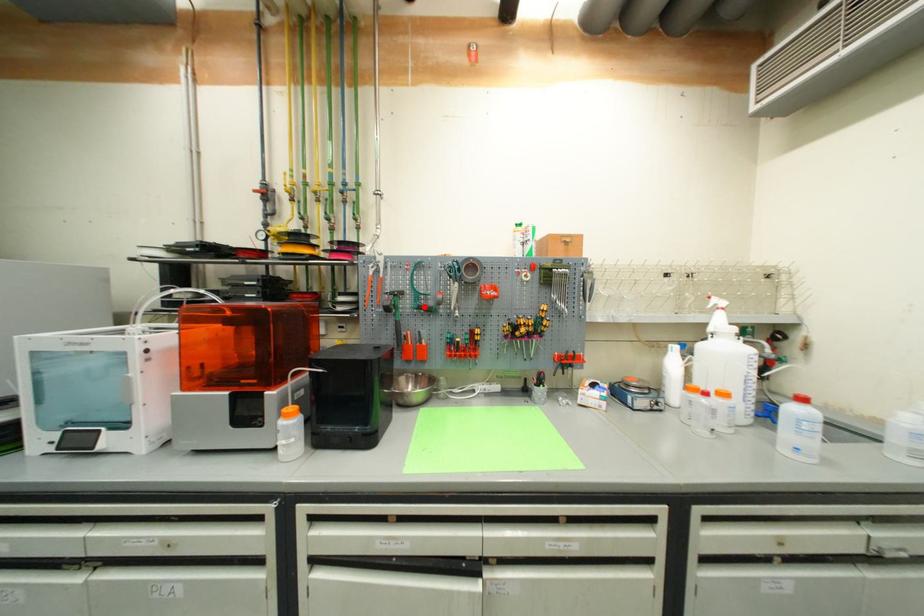
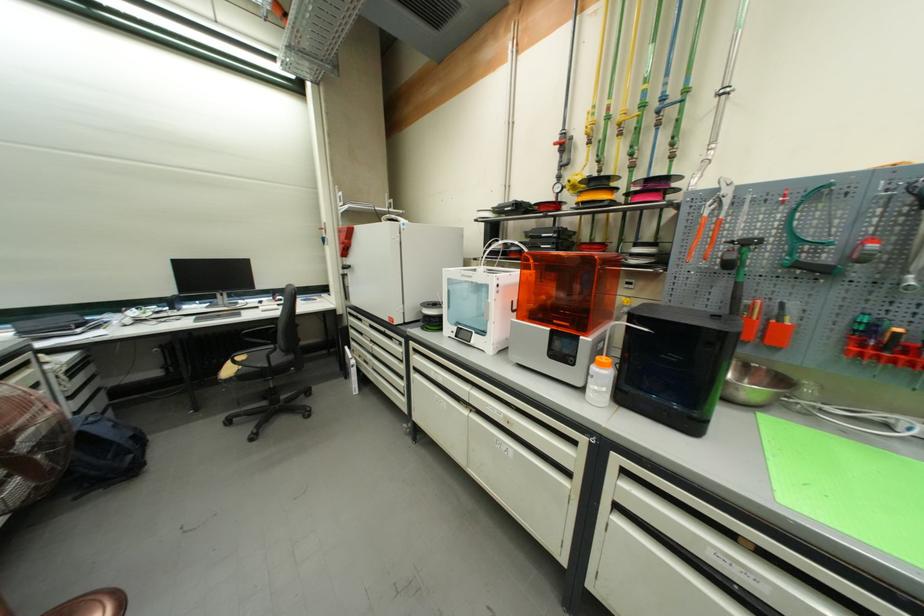
Where in the second image is the point corresponding to the highlighted location from the first image?

(803, 262)